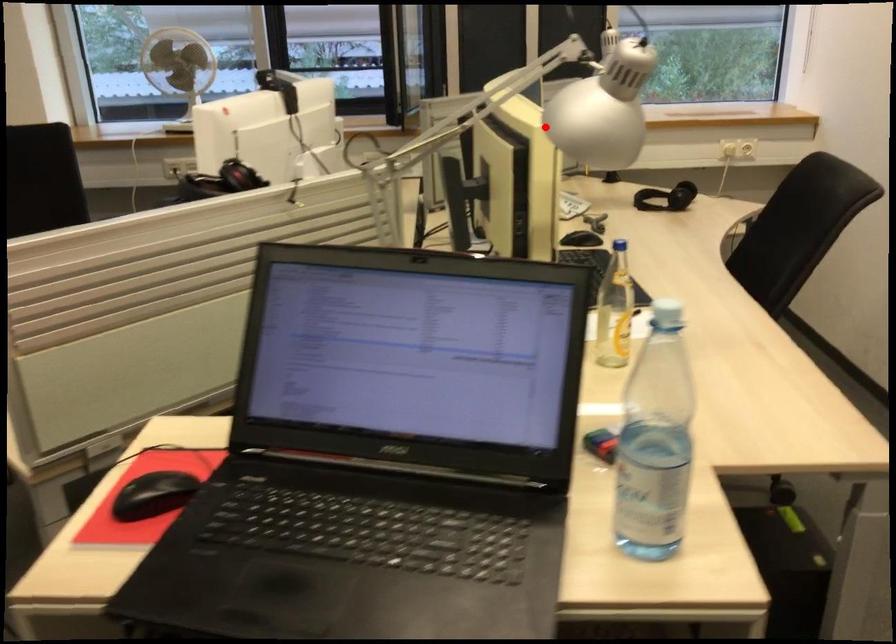
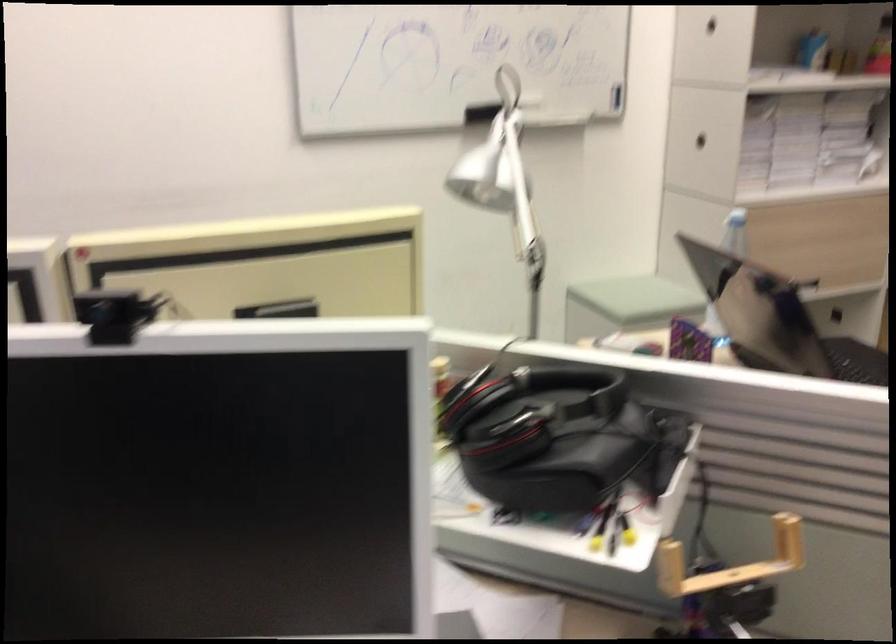
Where in the second image is the point corresponding to the highlighted location from the first image?

(504, 183)